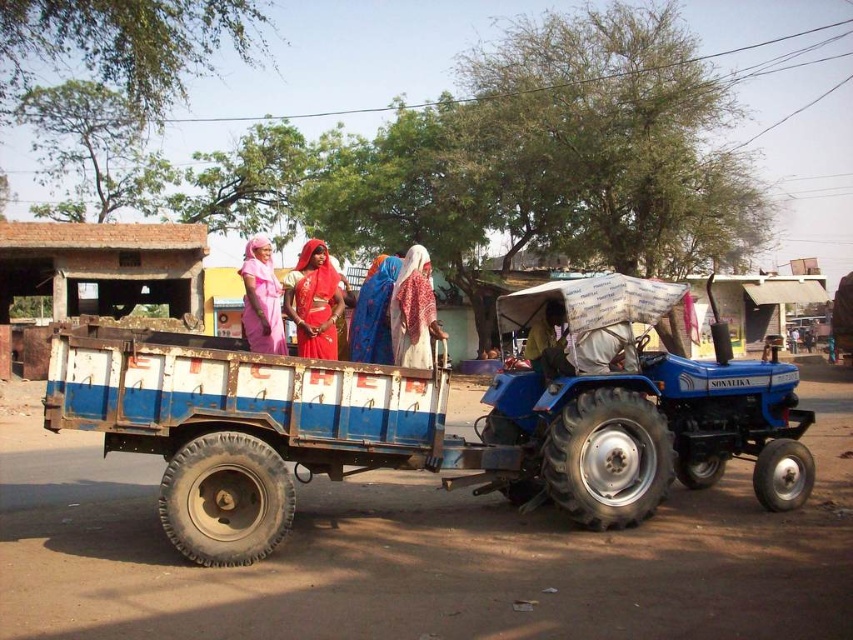
You are a photographer trying to capture a group photo of the blue metallic tractor at center and the white cotton dress at center. Since you want to emphasize the tractor, which object should you place closer to the camera to make it appear larger in the photo?

To make the blue metallic tractor at center appear larger in the photo, you should place it closer to the camera since it is smaller in size compared to the white cotton dress at center.

Based on the scene description, where is the matte red sari at center located in the image?

The matte red sari at center is located at point (314, 301) in the image.

You are a delivery person who needs to place a package between the blue metallic tractor at center and the white cotton dress at center. The package requires 3 feet of space. Can you fit it there?

The blue metallic tractor at center is 4.45 feet from the white cotton dress at center. Since the required space is 3 feet, the package can be placed between them as there is enough space.